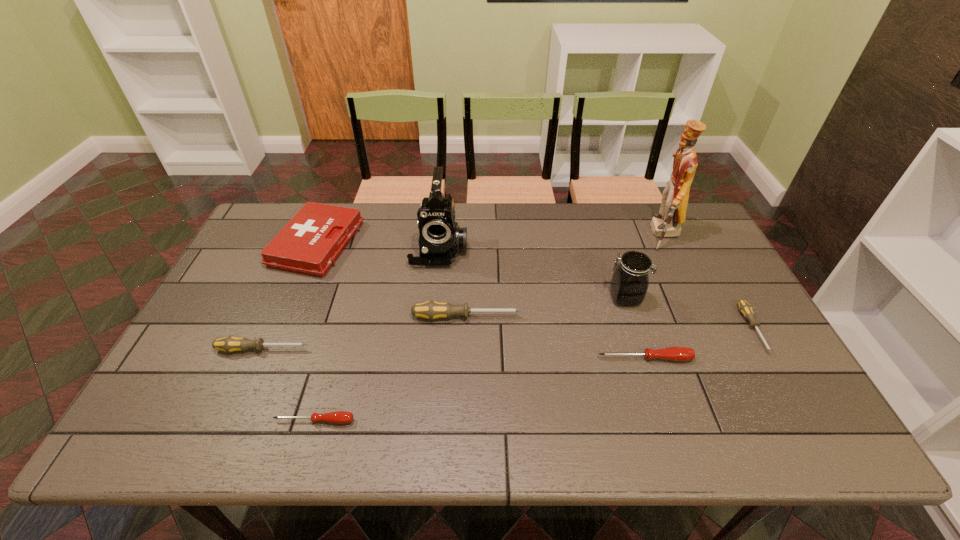
This screenshot has width=960, height=540. Find the location of `vacant area between the rightmost screwdriver and the third screwdriver from right to left`. vacant area between the rightmost screwdriver and the third screwdriver from right to left is located at coordinates (610, 323).

You are a GUI agent. You are given a task and a screenshot of the screen. Output one action in this format:
    pyautogui.click(x=<x>, y=<y>)
    Task: Click on the vacant space that's between the first-aid kit and the jar
    The width and height of the screenshot is (960, 540).
    Given the screenshot: What is the action you would take?
    pyautogui.click(x=470, y=271)

Select which object appears as the fourth closest to the jar. Please provide its 2D coordinates. Your answer should be formatted as a tuple, i.e. [(x, y)], where the tuple contains the x and y coordinates of a point satisfying the conditions above.

[(431, 310)]

Identify which object is located as the fifth nearest to the biggest gray screwdriver. Please provide its 2D coordinates. Your answer should be formatted as a tuple, i.e. [(x, y)], where the tuple contains the x and y coordinates of a point satisfying the conditions above.

[(230, 344)]

The height and width of the screenshot is (540, 960). I want to click on the closest screwdriver to the fourth screwdriver from left to right, so pyautogui.click(x=746, y=309).

This screenshot has width=960, height=540. What are the coordinates of `screwdriver that is the fourth closest to the jar` in the screenshot? It's located at (339, 417).

Point out which gray screwdriver is positioned as the second nearest to the second screwdriver from right to left. Please provide its 2D coordinates. Your answer should be formatted as a tuple, i.e. [(x, y)], where the tuple contains the x and y coordinates of a point satisfying the conditions above.

[(431, 310)]

Find the location of a particular element. This screenshot has width=960, height=540. gray screwdriver that stands as the closest to the jar is located at coordinates (746, 309).

Image resolution: width=960 pixels, height=540 pixels. In order to click on vacant region that satisfies the following two spatial constraints: 1. on the back side of the bigger red screwdriver; 2. at the tip of the biggest gray screwdriver in this screenshot , I will do `click(632, 317)`.

Locate an element on the screen. This screenshot has width=960, height=540. vacant area in the image that satisfies the following two spatial constraints: 1. on the back side of the fourth screwdriver from left to right; 2. on the lid of the seventh shortest object is located at coordinates (625, 298).